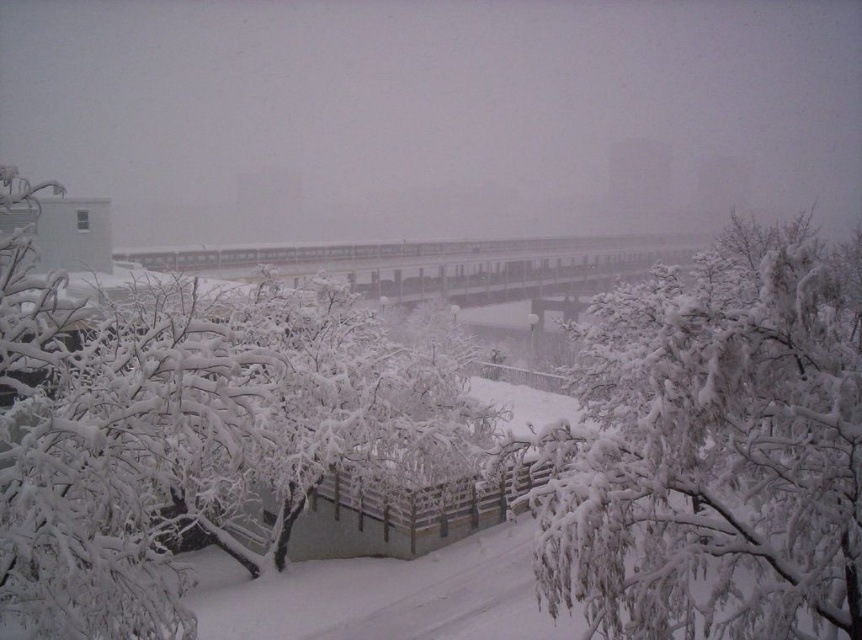
Question: Is white frosty tree at center further to camera compared to white frosty branches at center?

Choices:
 (A) no
 (B) yes

Answer: (A)

Question: Which of the following is the farthest from the observer?

Choices:
 (A) white frosty tree at center
 (B) white frosty branches at center

Answer: (B)

Question: Is white frosty tree at center to the right of white frosty branches at center from the viewer's perspective?

Choices:
 (A) yes
 (B) no

Answer: (B)

Question: Can you confirm if white frosty tree at center is positioned to the left of white frosty branches at center?

Choices:
 (A) yes
 (B) no

Answer: (A)